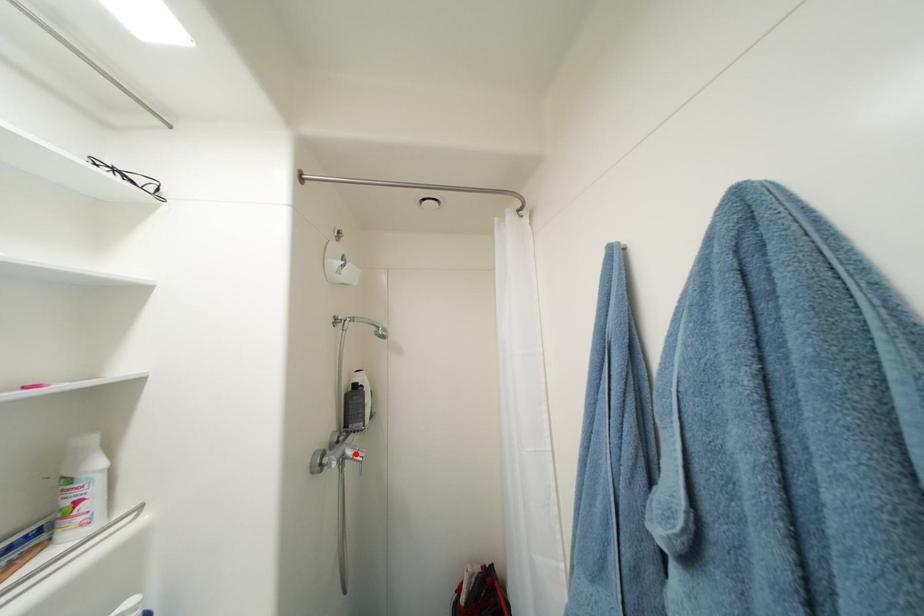
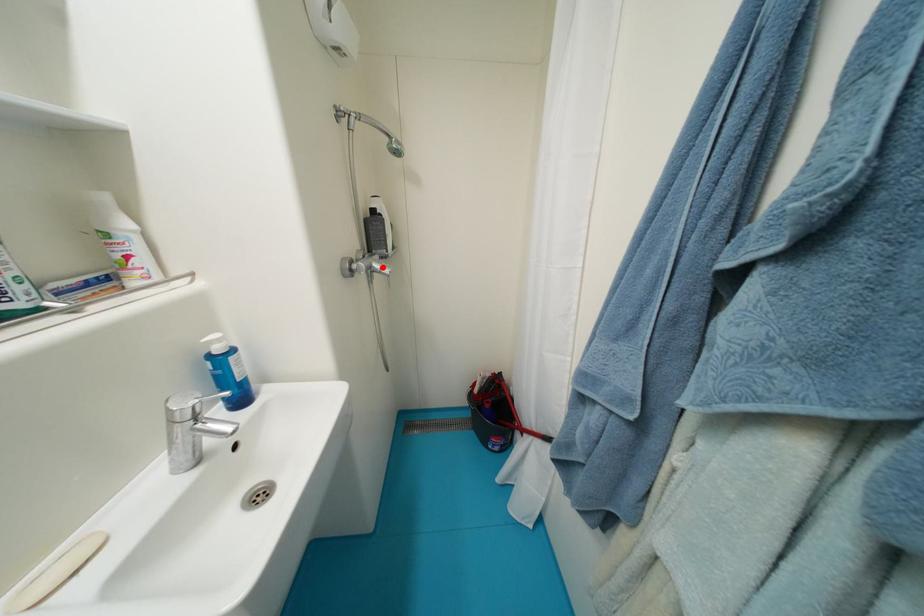
I am providing you with two images of the same scene from different viewpoints. A red point is marked on the first image and another point is marked on the second image. Are the points marked in image1 and image2 representing the same 3D position?

Yes